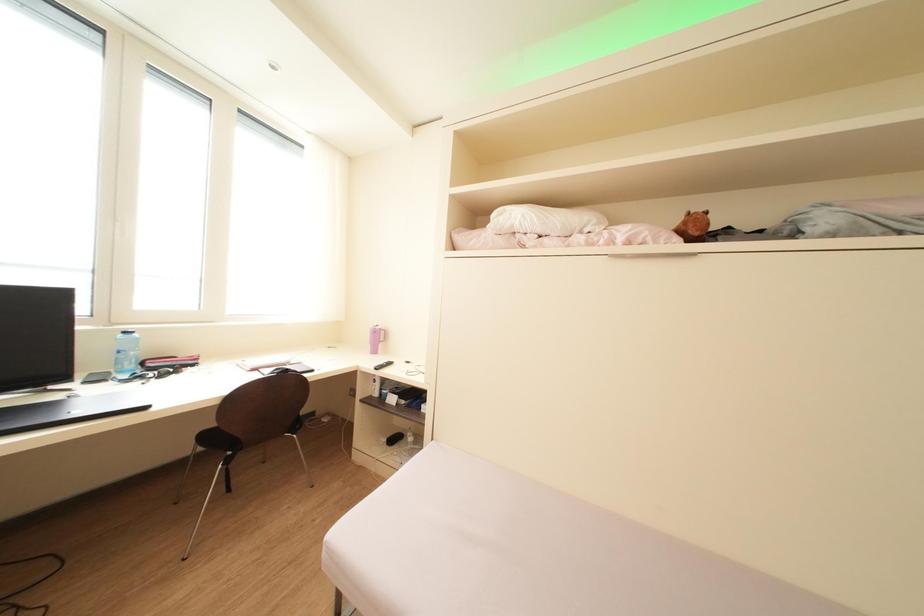
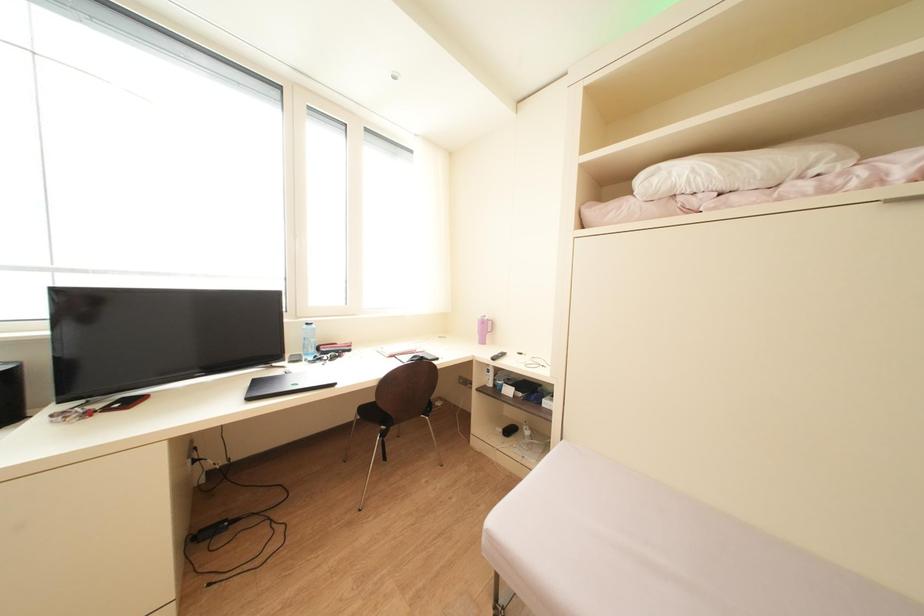
Question: In a continuous first-person perspective shot, in which direction is the camera moving?

Choices:
 (A) Left
 (B) Right
 (C) Forward
 (D) Backward

Answer: (A)